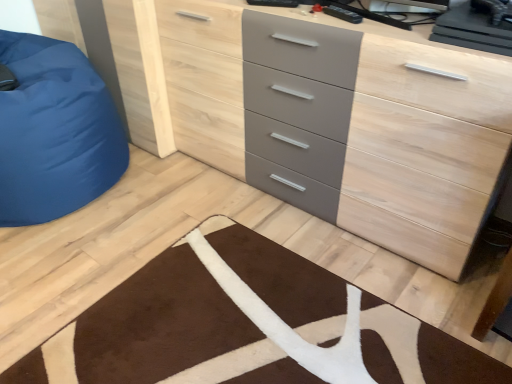
Where is `vacant region below brown plush rug at lower center (from a real-world perspective)`? vacant region below brown plush rug at lower center (from a real-world perspective) is located at coordinates (265, 331).